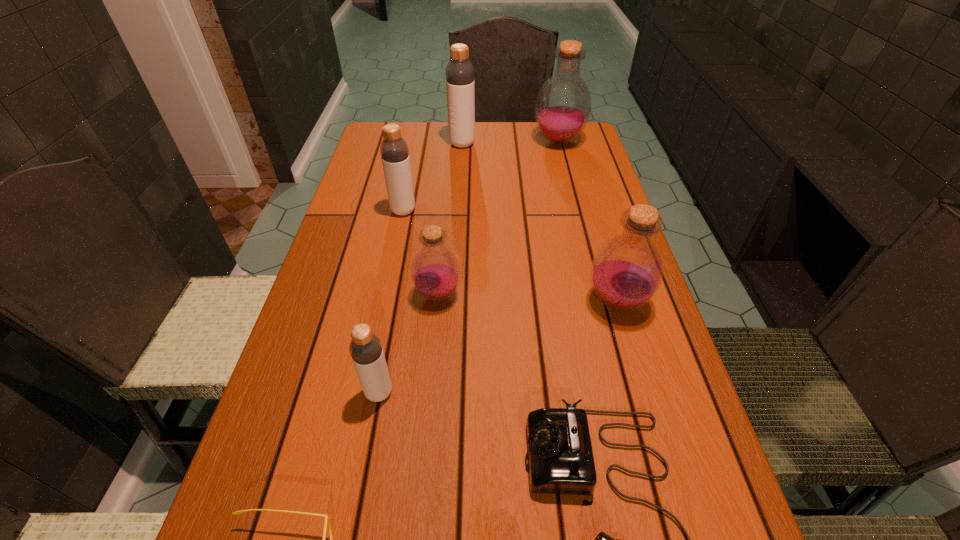
Locate an element on the screen. The image size is (960, 540). free spot between the leftmost purple bottle and the second biggest purple bottle is located at coordinates (527, 298).

Locate an element on the screen. vacant area that lies between the smallest gray bottle and the farthest purple bottle is located at coordinates (468, 267).

Locate an element on the screen. The height and width of the screenshot is (540, 960). unoccupied area between the fourth nearest bottle and the biggest gray bottle is located at coordinates (433, 177).

The height and width of the screenshot is (540, 960). I want to click on vacant area that lies between the second smallest purple bottle and the biggest gray bottle, so click(540, 222).

The width and height of the screenshot is (960, 540). Find the location of `free space that is in between the biggest purple bottle and the second smallest purple bottle`. free space that is in between the biggest purple bottle and the second smallest purple bottle is located at coordinates (588, 221).

This screenshot has width=960, height=540. I want to click on object that stands as the closest to the sixth farthest object, so [435, 271].

Find the location of a particular element. The image size is (960, 540). the seventh closest object to the second biggest purple bottle is located at coordinates (460, 85).

Where is `the third closest bottle to the shortest object`? This screenshot has height=540, width=960. the third closest bottle to the shortest object is located at coordinates (626, 272).

Select which bottle is the second closest to the leftmost purple bottle. Please provide its 2D coordinates. Your answer should be formatted as a tuple, i.e. [(x, y)], where the tuple contains the x and y coordinates of a point satisfying the conditions above.

[(394, 151)]

Select which gray bottle is the second closest to the farthest purple bottle. Please provide its 2D coordinates. Your answer should be formatted as a tuple, i.e. [(x, y)], where the tuple contains the x and y coordinates of a point satisfying the conditions above.

[(394, 151)]